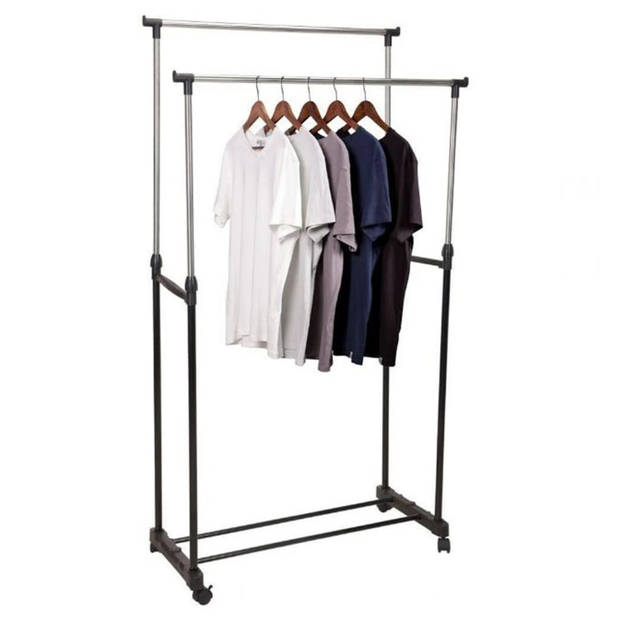
The image size is (620, 620). I want to click on coat hangers, so click(x=255, y=108), click(x=284, y=108), click(x=312, y=110), click(x=337, y=108), click(x=371, y=113).